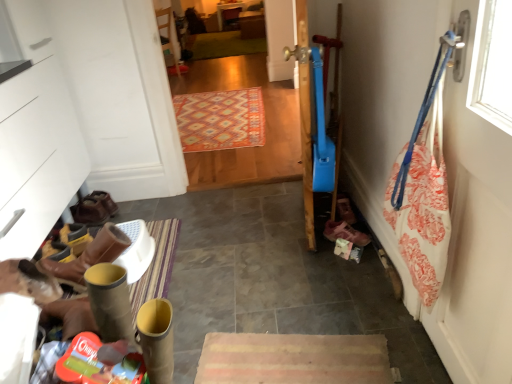
Locate an element on the screen. The image size is (512, 384). vacant area situated to the left side of pink fabric shoe at lower right, which is the 1th footwear in front-to-back order is located at coordinates (304, 249).